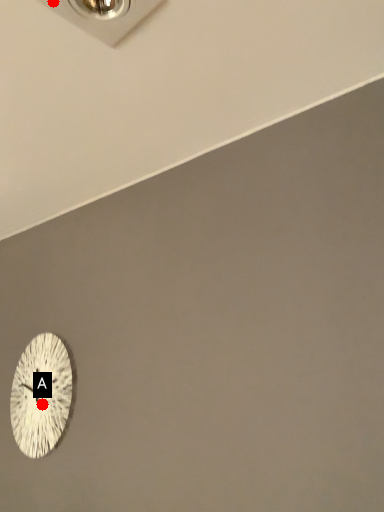
Question: Two points are circled on the image, labeled by A and B beside each circle. Which point appears closest to the camera in this image?

Choices:
 (A) A is closer
 (B) B is closer

Answer: (B)